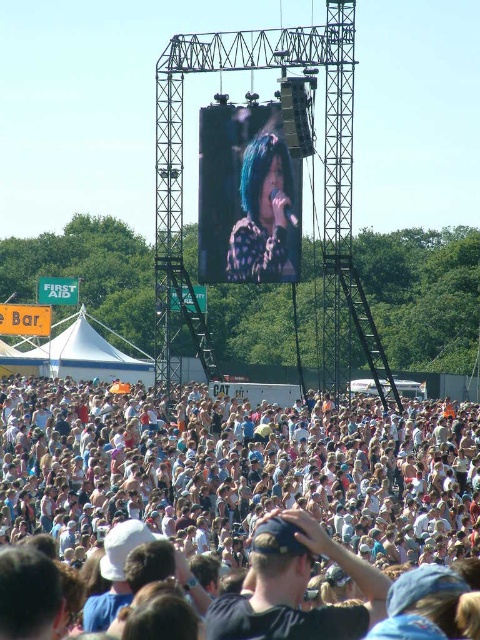
Which is in front, point (38, 512) or point (254, 193)?

Point (38, 512) is in front.

Does white cotton crowd at lower center lie in front of shiny purple hair at center?

That is True.

Which is behind, point (308, 595) or point (264, 188)?

The point (264, 188) is more distant.

This screenshot has height=640, width=480. I want to click on white cotton crowd at lower center, so click(232, 509).